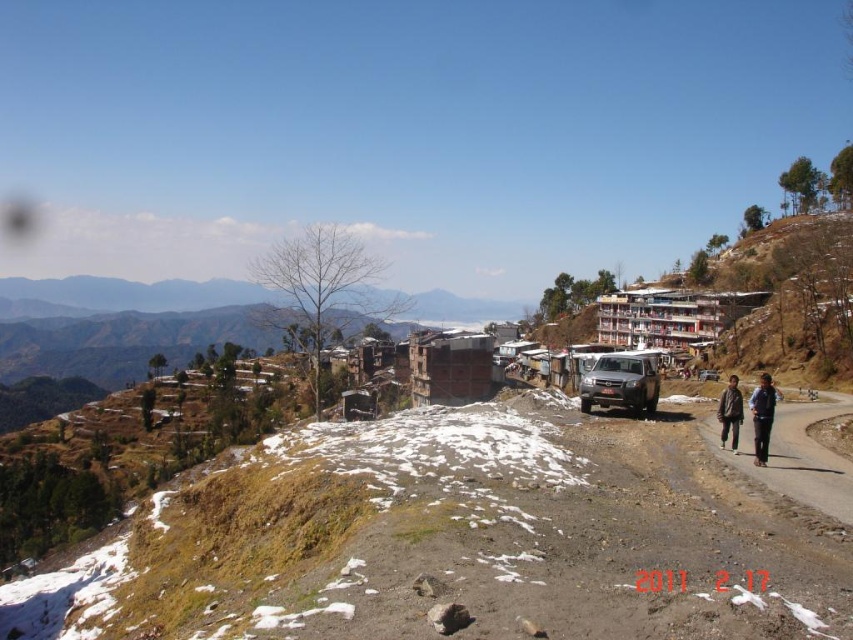
Does matte silver jeep at center-right have a smaller size compared to dark blue fabric at right?

No, matte silver jeep at center-right is not smaller than dark blue fabric at right.

Locate an element on the screen. This screenshot has width=853, height=640. matte silver jeep at center-right is located at coordinates (621, 384).

Is point (607, 353) less distant than point (761, 392)?

That is False.

Locate an element on the screen. The height and width of the screenshot is (640, 853). matte silver jeep at center-right is located at coordinates (x=621, y=384).

Does dirt road at lower right appear over dark brown leather jacket at lower right?

Actually, dirt road at lower right is below dark brown leather jacket at lower right.

Between dirt road at lower right and dark brown leather jacket at lower right, which one appears on the right side from the viewer's perspective?

dark brown leather jacket at lower right

The image size is (853, 640). I want to click on dirt road at lower right, so click(x=796, y=456).

Looking at this image, which is above, matte silver jeep at center-right or brown fabric jacket at lower right?

matte silver jeep at center-right is higher up.

Measure the distance between matte silver jeep at center-right and camera.

matte silver jeep at center-right is 60.28 meters away from camera.

This screenshot has height=640, width=853. In order to click on matte silver jeep at center-right in this screenshot , I will do `click(621, 384)`.